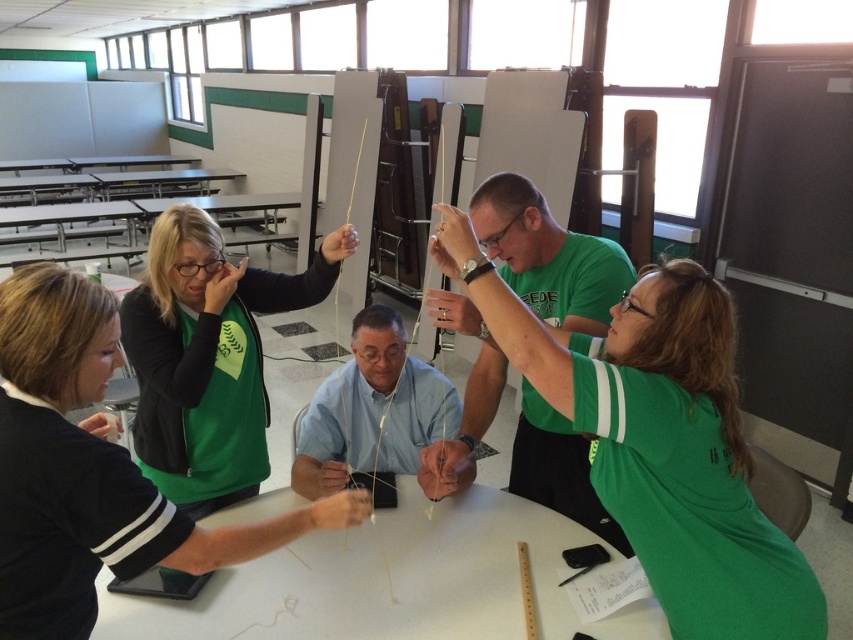
Question: Which object appears farthest from the camera in this image?

Choices:
 (A) green fabric table at upper center
 (B) black plastic table at upper center

Answer: (B)

Question: Does green matte shirt at upper right lie behind black matte jacket at upper left?

Choices:
 (A) yes
 (B) no

Answer: (A)

Question: Does green matte shirt at upper right have a smaller size compared to black matte jacket at upper left?

Choices:
 (A) yes
 (B) no

Answer: (B)

Question: Which object is the farthest from the green matte shirt at center?

Choices:
 (A) black matte jacket at upper left
 (B) green fabric table at upper center

Answer: (B)

Question: Can you confirm if green matte shirt at center is positioned to the left of metallic silver table at upper left?

Choices:
 (A) yes
 (B) no

Answer: (B)

Question: Among these objects, which one is nearest to the camera?

Choices:
 (A) blue fabric shirt at center
 (B) green matte shirt at upper center

Answer: (B)